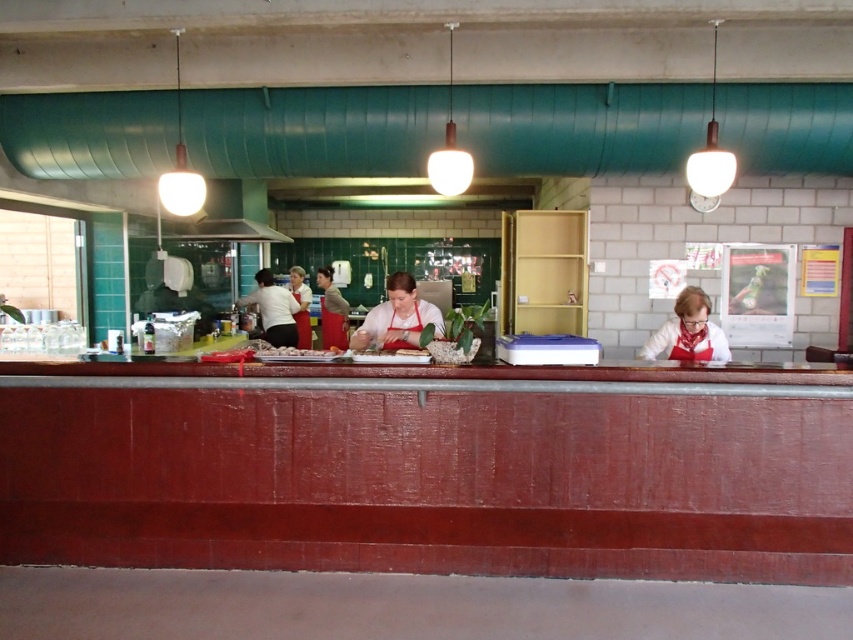
Is point (704, 342) positioned after point (328, 333)?

No.

Is white glossy apron at center wider than matte beige apron at center?

Correct, the width of white glossy apron at center exceeds that of matte beige apron at center.

Measure the distance between white glossy apron at center and camera.

They are 4.15 meters apart.

Identify the location of white glossy apron at center. Image resolution: width=853 pixels, height=640 pixels. (688, 332).

Who is lower down, red matte apron at center or white glossy tray at center?

white glossy tray at center

The image size is (853, 640). What do you see at coordinates (398, 317) in the screenshot?
I see `red matte apron at center` at bounding box center [398, 317].

Describe the element at coordinates (398, 317) in the screenshot. I see `red matte apron at center` at that location.

Where is `red matte apron at center`? This screenshot has height=640, width=853. red matte apron at center is located at coordinates pyautogui.click(x=398, y=317).

Based on the photo, which is more to the right, matte beige apron at center or matte white apron at center?

From the viewer's perspective, matte beige apron at center appears more on the right side.

Does matte beige apron at center have a smaller size compared to matte white apron at center?

No, matte beige apron at center is not smaller than matte white apron at center.

Where is `matte beige apron at center`? The height and width of the screenshot is (640, 853). matte beige apron at center is located at coordinates (332, 312).

Find the location of a particular element. The width and height of the screenshot is (853, 640). matte beige apron at center is located at coordinates (332, 312).